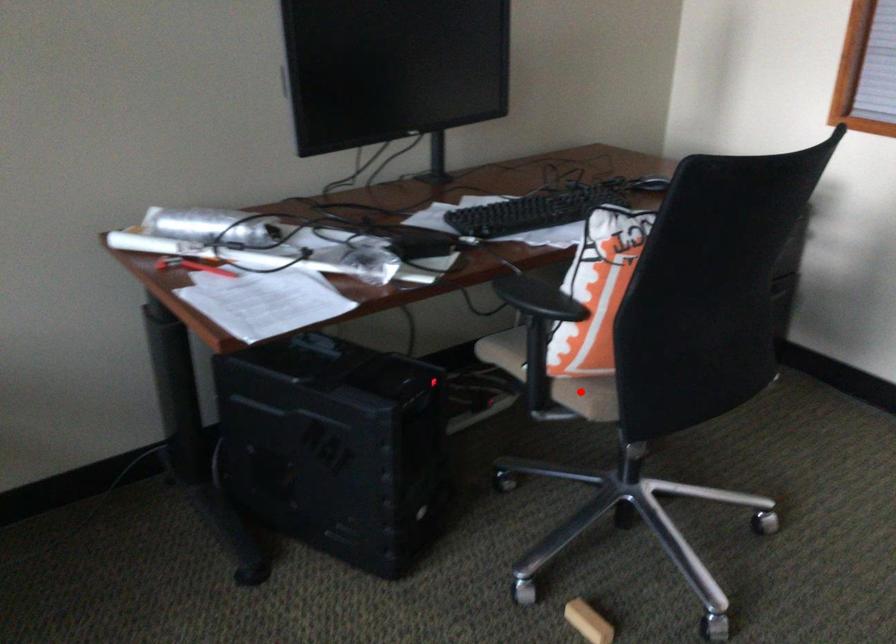
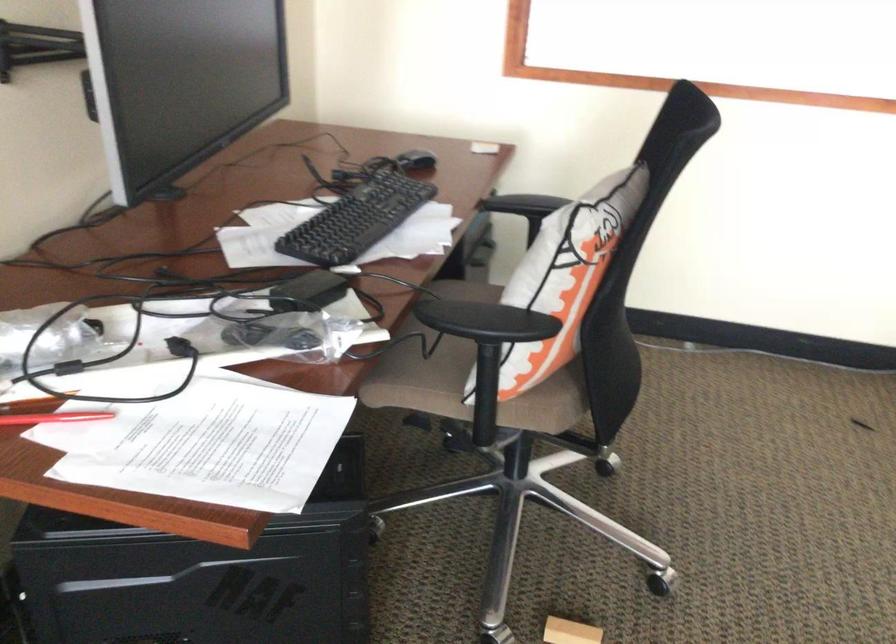
Question: A red point is marked in image1. In image2, is the corresponding 3D point closer to the camera or farther? Reply with the corresponding letter.

Choices:
 (A) The corresponding 3D point is closer.
 (B) The corresponding 3D point is farther.

Answer: (A)